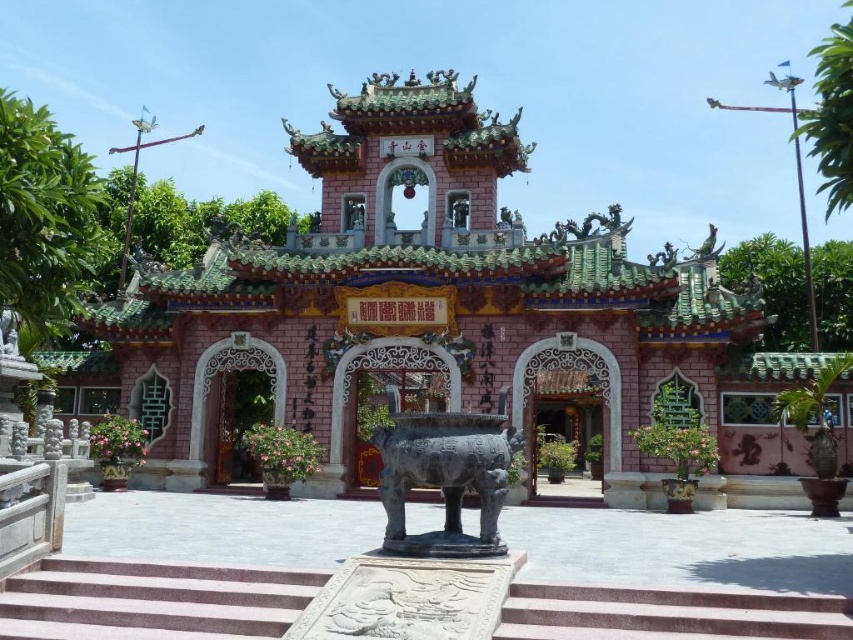
Question: Estimate the real-world distances between objects in this image. Which object is farther from the pink marble stairs at center?

Choices:
 (A) pink stone palace at center
 (B) black polished bronze statue at center

Answer: (A)

Question: Considering the real-world distances, which object is closest to the pink stone archway at center?

Choices:
 (A) pink marble stairs at center
 (B) black polished bronze statue at center

Answer: (B)

Question: From the image, what is the correct spatial relationship of black polished bronze statue at center in relation to pink stone archway at center?

Choices:
 (A) right
 (B) left

Answer: (B)

Question: Can you confirm if black polished bronze statue at center is wider than pink stone archway at center?

Choices:
 (A) no
 (B) yes

Answer: (A)

Question: Which of the following is the farthest from the observer?

Choices:
 (A) black polished bronze statue at center
 (B) pink stone palace at center

Answer: (B)

Question: Is the position of pink stone palace at center less distant than that of pink marble stairs at center?

Choices:
 (A) yes
 (B) no

Answer: (B)